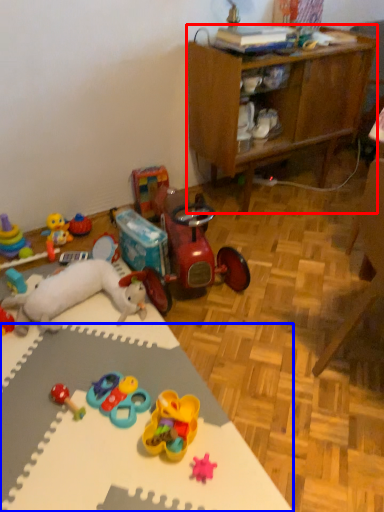
Question: Among these objects, which one is farthest to the camera, cabinetry (highlighted by a red box) or desk (highlighted by a blue box)?

Choices:
 (A) cabinetry
 (B) desk

Answer: (A)